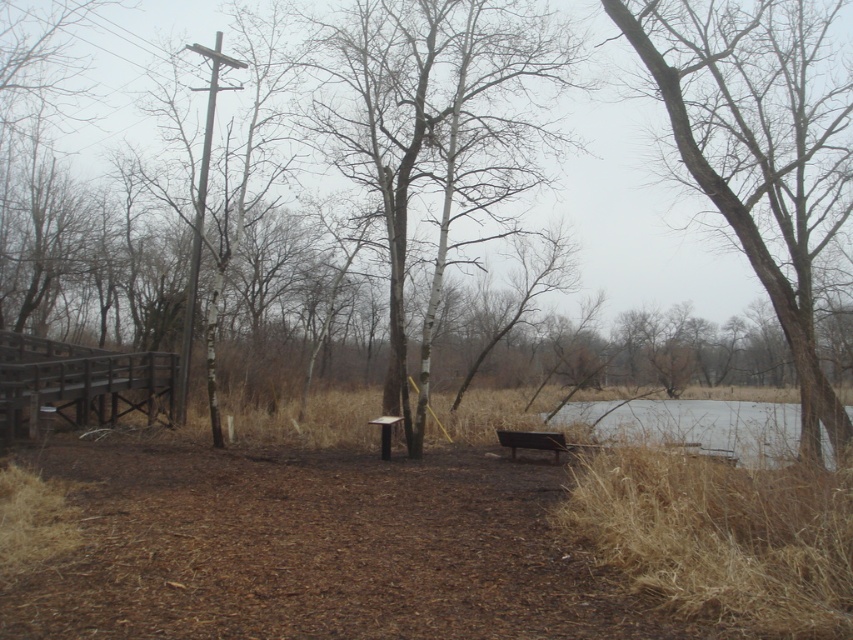
Question: Is bare wood tree at center bigger than brown wooden bench at center?

Choices:
 (A) no
 (B) yes

Answer: (B)

Question: Which point is closer to the camera?

Choices:
 (A) (61, 339)
 (B) (790, 349)

Answer: (B)

Question: Among these points, which one is farthest from the camera?

Choices:
 (A) (747, 125)
 (B) (376, 125)
 (C) (544, 132)

Answer: (B)

Question: Does bare wood tree at center appear on the right side of clear water at lower right?

Choices:
 (A) yes
 (B) no

Answer: (B)

Question: Which object appears closest to the camera in this image?

Choices:
 (A) bare wood tree at center
 (B) brown wood tree at center

Answer: (B)

Question: Is clear water at lower right below wooden picnic table at center?

Choices:
 (A) yes
 (B) no

Answer: (A)